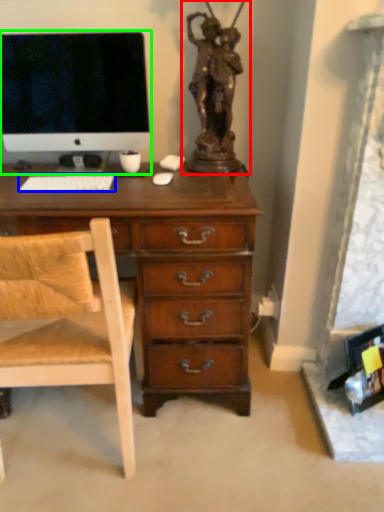
Question: Based on their relative distances, which object is farther from sculpture (highlighted by a red box)? Choose from computer keyboard (highlighted by a blue box) and computer monitor (highlighted by a green box).

Choices:
 (A) computer keyboard
 (B) computer monitor

Answer: (A)